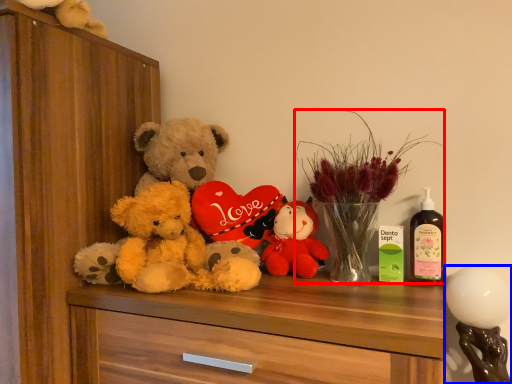
Question: Which object appears closest to the camera in this image, floral arrangement (highlighted by a red box) or toy (highlighted by a blue box)?

Choices:
 (A) floral arrangement
 (B) toy

Answer: (B)